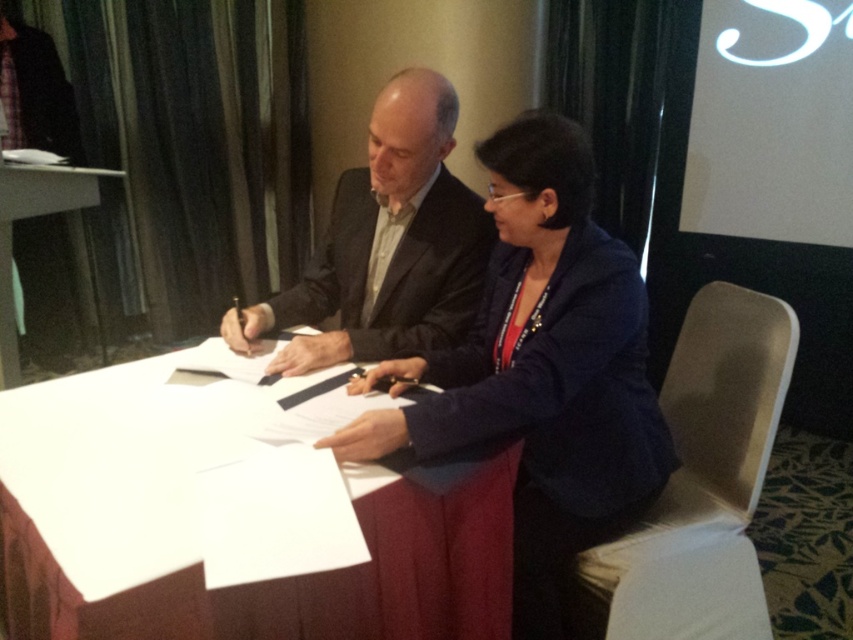
Question: Which point is farther to the camera?

Choices:
 (A) matte black suit at center
 (B) white paper at center
 (C) dark blue fabric jacket at center

Answer: (A)

Question: Is dark blue fabric jacket at center thinner than matte black suit at center?

Choices:
 (A) yes
 (B) no

Answer: (B)

Question: Which of these objects is positioned closest to the dark blue fabric jacket at center?

Choices:
 (A) matte black suit at center
 (B) white paper at center

Answer: (B)

Question: Considering the real-world distances, which object is closest to the dark blue fabric jacket at center?

Choices:
 (A) white paper at center
 (B) matte black suit at center

Answer: (A)

Question: Is dark blue fabric jacket at center closer to the viewer compared to matte black suit at center?

Choices:
 (A) no
 (B) yes

Answer: (B)

Question: Can you confirm if white paper at center is bigger than matte black suit at center?

Choices:
 (A) yes
 (B) no

Answer: (A)